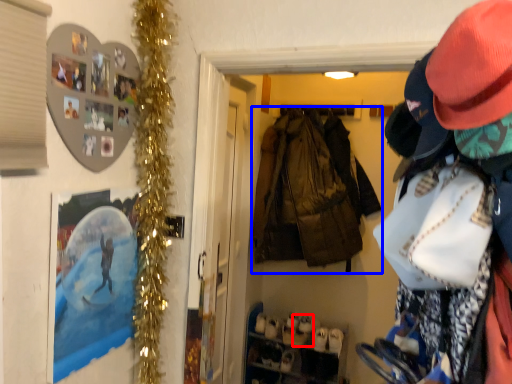
Question: Which object is further to the camera taking this photo, shoe (highlighted by a red box) or jacket (highlighted by a blue box)?

Choices:
 (A) shoe
 (B) jacket

Answer: (A)